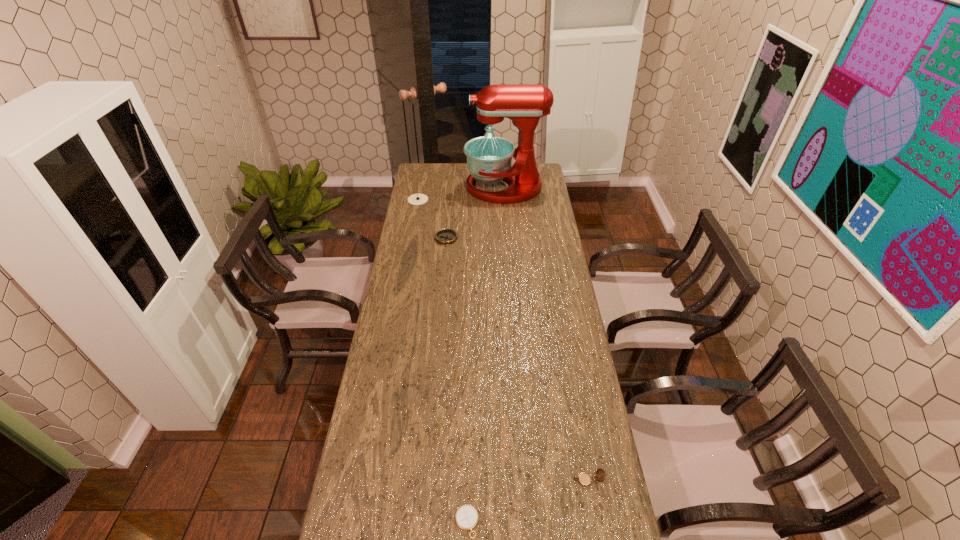
Locate an element on the screen. The height and width of the screenshot is (540, 960). compass located in the right edge section of the desktop is located at coordinates (584, 479).

Locate an element on the screen. Image resolution: width=960 pixels, height=540 pixels. object at the far right corner is located at coordinates (489, 158).

The width and height of the screenshot is (960, 540). Identify the location of free space at the left edge. (412, 255).

Locate an element on the screen. vacant area at the right edge is located at coordinates (584, 368).

The height and width of the screenshot is (540, 960). In the image, there is a desktop. Identify the location of vacant area at the far left corner. (437, 169).

Find the location of `vacant space at the far right corner of the desktop`. vacant space at the far right corner of the desktop is located at coordinates (541, 168).

The height and width of the screenshot is (540, 960). Identify the location of free space between the third compass from left to right and the fourth farthest object. (527, 501).

This screenshot has height=540, width=960. I want to click on empty space between the tallest object and the leftmost compass, so click(461, 194).

Find the location of `free point between the leftmost compass and the tallest object`. free point between the leftmost compass and the tallest object is located at coordinates (461, 194).

Locate an element on the screen. This screenshot has height=540, width=960. vacant area that lies between the third farthest object and the leftmost object is located at coordinates (432, 219).